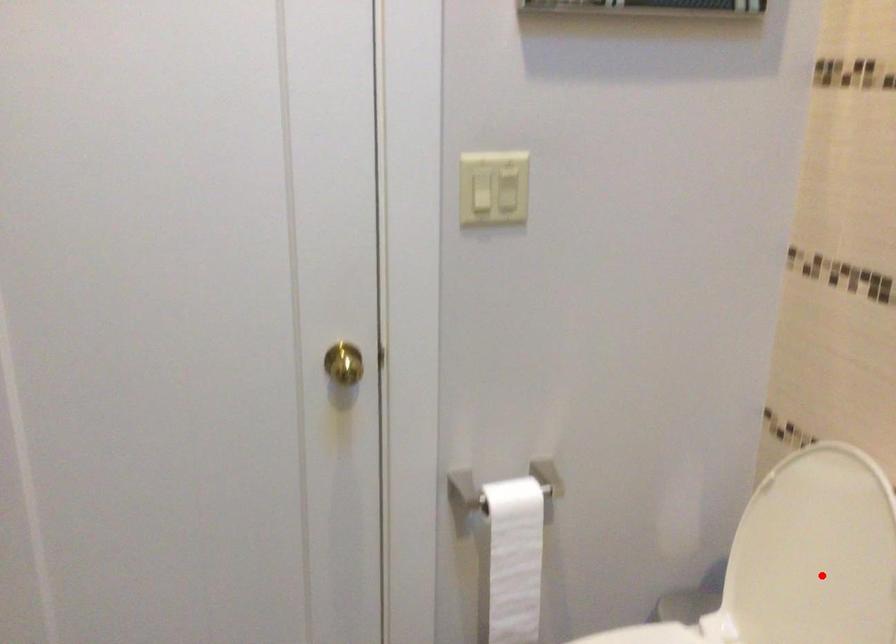
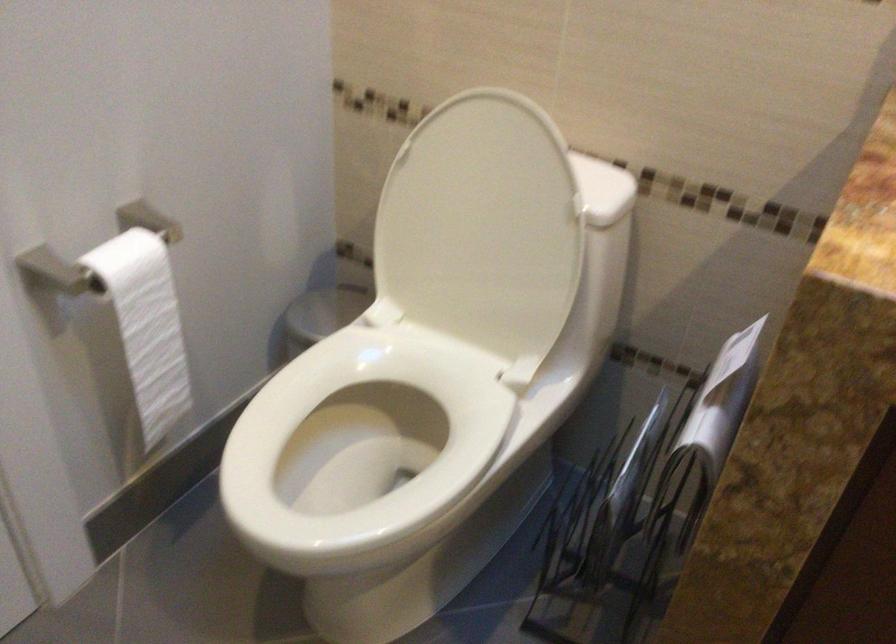
Where in the second image is the point corresponding to the highlighted location from the first image?

(483, 228)